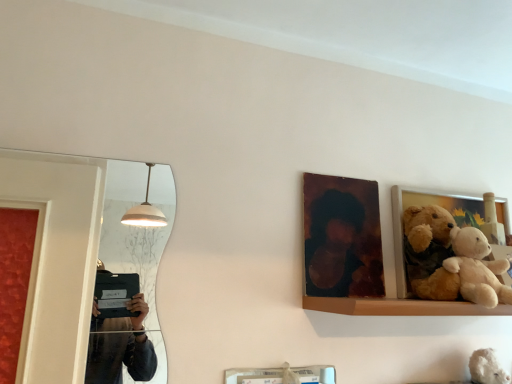
Question: From a real-world perspective, is soft plush teddy bear at right above or below white plush teddy bear at lower right?

Choices:
 (A) above
 (B) below

Answer: (A)

Question: In terms of height, does soft plush teddy bear at right look taller or shorter compared to white plush teddy bear at lower right?

Choices:
 (A) tall
 (B) short

Answer: (B)

Question: Which object is positioned closest to the white plush teddy bear at lower right?

Choices:
 (A) soft plush teddy bear at right
 (B) wooden photo frame at upper center, positioned as the second picture frame in right-to-left order
 (C) wooden picture frame at right, marked as the first picture frame in a right-to-left arrangement

Answer: (A)

Question: Which is nearer to the soft plush teddy bear at right?

Choices:
 (A) white plush teddy bear at lower right
 (B) wooden picture frame at right, the 2th picture frame from the left
 (C) wooden photo frame at upper center, the first picture frame positioned from the left

Answer: (B)